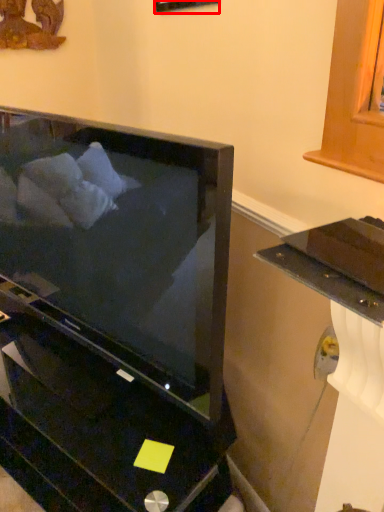
Question: From the image's perspective, where is picture frame (annotated by the red box) located relative to furniture?

Choices:
 (A) above
 (B) below

Answer: (A)